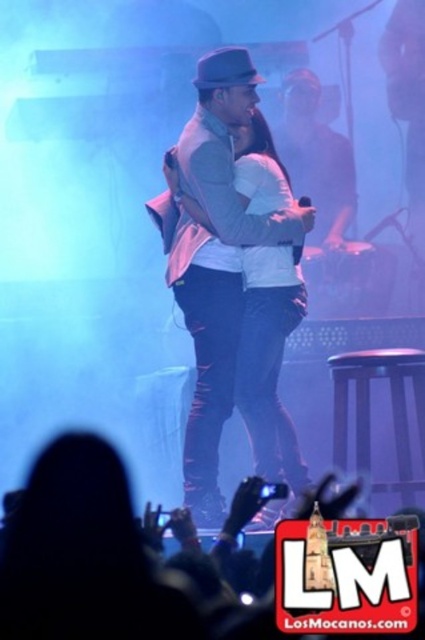
Question: Is white matte vest at center thinner than matte black fedora at upper center?

Choices:
 (A) no
 (B) yes

Answer: (A)

Question: Is white matte vest at center bigger than brown wooden stool at lower right?

Choices:
 (A) no
 (B) yes

Answer: (B)

Question: Based on their relative distances, which object is farther from the matte black fedora at upper center?

Choices:
 (A) white matte vest at center
 (B) brown wooden stool at lower right

Answer: (B)

Question: Does brown wooden stool at lower right have a larger size compared to matte black fedora at upper center?

Choices:
 (A) no
 (B) yes

Answer: (B)

Question: Which of the following is the farthest from the observer?

Choices:
 (A) brown wooden stool at lower right
 (B) matte black fedora at upper center

Answer: (A)

Question: Based on their relative distances, which object is nearer to the brown wooden stool at lower right?

Choices:
 (A) matte black fedora at upper center
 (B) white matte vest at center

Answer: (B)